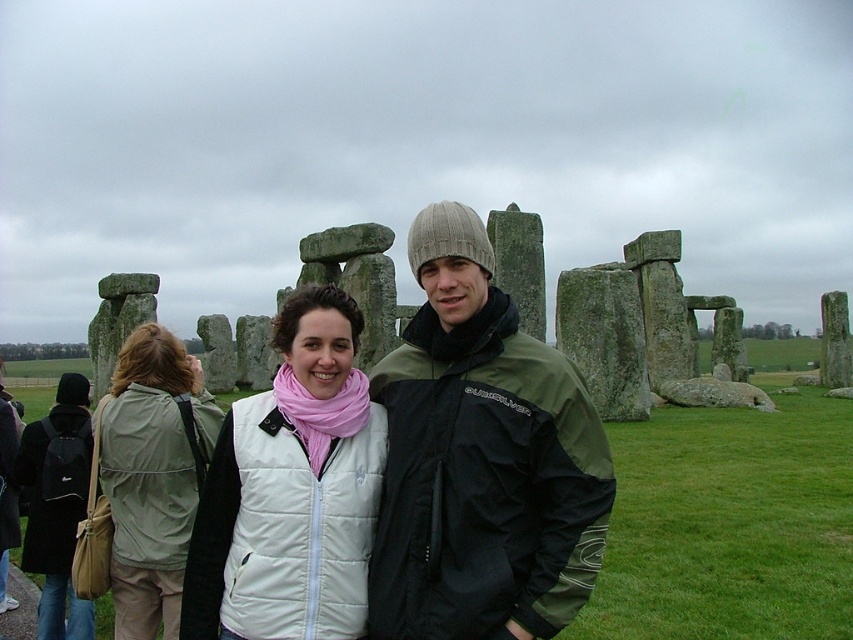
Can you confirm if olive-green/black jacket at center is shorter than white puffy vest at center?

Incorrect, olive-green/black jacket at center's height does not fall short of white puffy vest at center's.

Who is more distant from viewer, (x=485, y=499) or (x=276, y=456)?

The point (x=276, y=456) is more distant.

This screenshot has width=853, height=640. I want to click on olive-green/black jacket at center, so click(480, 460).

Who is lower down, olive-green/black jacket at center or light beige fabric jacket at lower left?

light beige fabric jacket at lower left is below.

Which is above, olive-green/black jacket at center or light beige fabric jacket at lower left?

olive-green/black jacket at center is above.

Is point (537, 545) farther from camera compared to point (132, 397)?

No.

Where is `olive-green/black jacket at center`? olive-green/black jacket at center is located at coordinates (480, 460).

Can you confirm if white puffy vest at center is positioned to the right of light beige fabric jacket at lower left?

Correct, you'll find white puffy vest at center to the right of light beige fabric jacket at lower left.

Between white puffy vest at center and light beige fabric jacket at lower left, which one has less height?

light beige fabric jacket at lower left

The image size is (853, 640). Describe the element at coordinates (291, 490) in the screenshot. I see `white puffy vest at center` at that location.

Where is `white puffy vest at center`? This screenshot has width=853, height=640. white puffy vest at center is located at coordinates (291, 490).